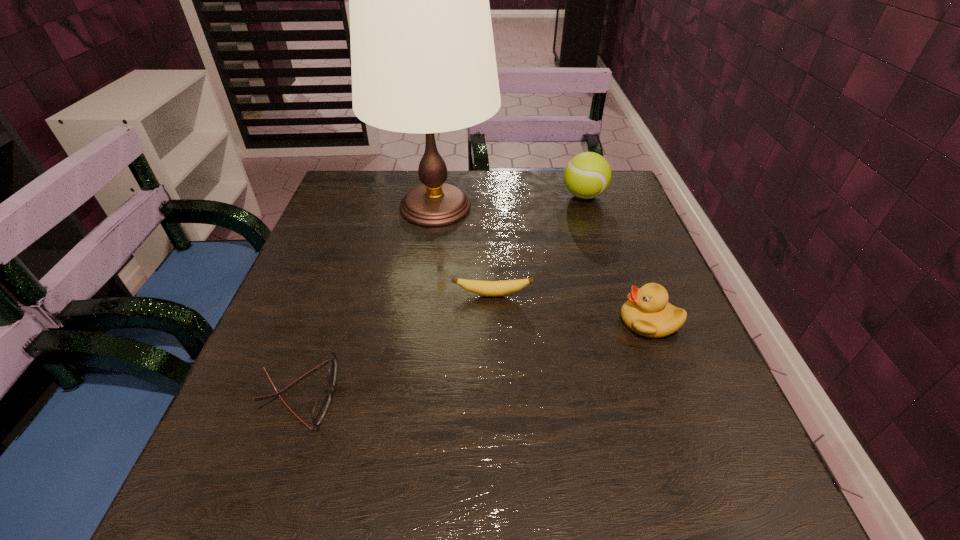
You are a GUI agent. You are given a task and a screenshot of the screen. Output one action in this format:
    pyautogui.click(x=<x>, y=<y>)
    Task: Click on the free space located 0.280m on the front-facing side of the second nearest object
    This screenshot has width=960, height=540.
    Given the screenshot: What is the action you would take?
    pyautogui.click(x=474, y=321)

You are a GUI agent. You are given a task and a screenshot of the screen. Output one action in this format:
    pyautogui.click(x=<x>, y=<y>)
    Task: Click on the vacant area located 0.350m on the back of the third nearest object
    The image size is (960, 540).
    Given the screenshot: What is the action you would take?
    pyautogui.click(x=490, y=199)

You are a GUI agent. You are given a task and a screenshot of the screen. Output one action in this format:
    pyautogui.click(x=<x>, y=<y>)
    Task: Click on the free location located 0.170m on the front-facing side of the spectacles
    The width and height of the screenshot is (960, 540).
    Given the screenshot: What is the action you would take?
    click(439, 394)

The image size is (960, 540). Identify the location of lamp positioned at the far edge. (423, 60).

In order to click on tennis ball present at the far edge in this screenshot , I will do `click(587, 175)`.

Find the location of `lamp positioned at the left edge`. lamp positioned at the left edge is located at coordinates (423, 60).

The height and width of the screenshot is (540, 960). I want to click on spectacles located in the left edge section of the desktop, so click(320, 408).

Locate an element on the screen. Image resolution: width=960 pixels, height=540 pixels. tennis ball present at the right edge is located at coordinates (587, 175).

You are a GUI agent. You are given a task and a screenshot of the screen. Output one action in this format:
    pyautogui.click(x=<x>, y=<y>)
    Task: Click on the duckling located at the right edge
    The width and height of the screenshot is (960, 540).
    Given the screenshot: What is the action you would take?
    pyautogui.click(x=647, y=312)

Find the location of `object that is at the far left corner`. object that is at the far left corner is located at coordinates (423, 60).